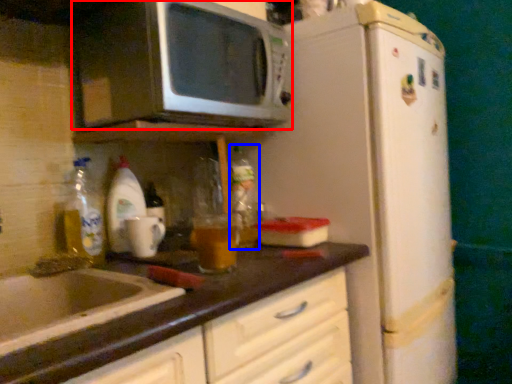
Question: Which point is further to the camera, microwave oven (highlighted by a red box) or bottle (highlighted by a blue box)?

Choices:
 (A) microwave oven
 (B) bottle

Answer: (B)